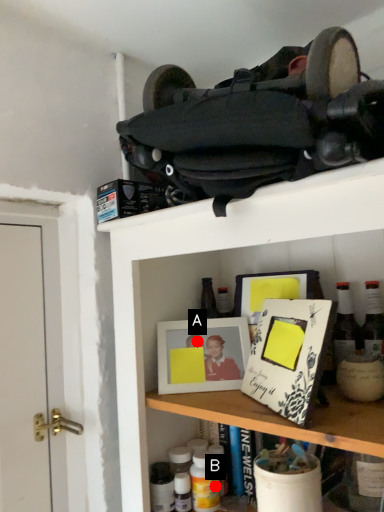
Question: Two points are circled on the image, labeled by A and B beside each circle. Which point is closer to the camera?

Choices:
 (A) A is closer
 (B) B is closer

Answer: (B)